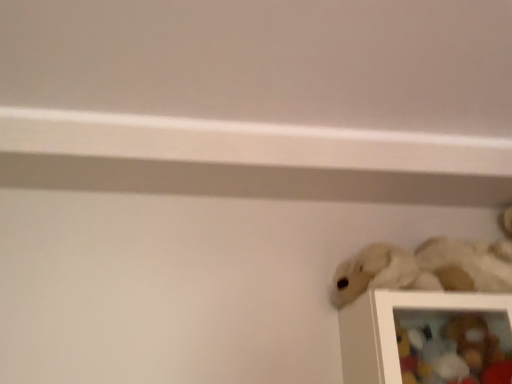
Question: Does white plush toy at lower right, placed as the 2th toy when sorted from bottom to top, have a greater width compared to fuzzy white stuffed animal at lower right, acting as the first toy starting from the top?

Choices:
 (A) yes
 (B) no

Answer: (B)

Question: Is white plush toy at lower right, which is the 2th toy in top-to-bottom order, positioned behind fuzzy white stuffed animal at lower right, the 3th toy from the bottom?

Choices:
 (A) no
 (B) yes

Answer: (B)

Question: Does white plush toy at lower right, which is the 2th toy in top-to-bottom order, appear on the left side of fuzzy white stuffed animal at lower right, the 3th toy from the bottom?

Choices:
 (A) no
 (B) yes

Answer: (B)

Question: Is the depth of white plush toy at lower right, placed as the 2th toy when sorted from bottom to top, less than that of fuzzy white stuffed animal at lower right, the 3th toy from the bottom?

Choices:
 (A) yes
 (B) no

Answer: (B)

Question: Can you see white plush toy at lower right, placed as the 2th toy when sorted from bottom to top, touching fuzzy white stuffed animal at lower right, acting as the first toy starting from the top?

Choices:
 (A) no
 (B) yes

Answer: (A)

Question: From the image's perspective, would you say white plush toy at lower right, placed as the 2th toy when sorted from bottom to top, is positioned over fuzzy white stuffed animal at lower right, acting as the first toy starting from the top?

Choices:
 (A) yes
 (B) no

Answer: (B)

Question: Is soft plush toy at lower right, which appears as the third toy when viewed from the top, facing towards white plush toy at lower right, which is the 2th toy in top-to-bottom order?

Choices:
 (A) yes
 (B) no

Answer: (B)

Question: Can you confirm if soft plush toy at lower right, which appears as the third toy when viewed from the top, is smaller than white plush toy at lower right, placed as the 2th toy when sorted from bottom to top?

Choices:
 (A) no
 (B) yes

Answer: (A)

Question: Can white plush toy at lower right, placed as the 2th toy when sorted from bottom to top, be found inside soft plush toy at lower right, which appears as the third toy when viewed from the top?

Choices:
 (A) no
 (B) yes

Answer: (B)

Question: From a real-world perspective, is soft plush toy at lower right, the first toy when ordered from bottom to top, on white plush toy at lower right, placed as the 2th toy when sorted from bottom to top?

Choices:
 (A) yes
 (B) no

Answer: (B)

Question: From the image's perspective, is soft plush toy at lower right, which appears as the third toy when viewed from the top, located beneath white plush toy at lower right, which is the 2th toy in top-to-bottom order?

Choices:
 (A) no
 (B) yes

Answer: (B)

Question: Is soft plush toy at lower right, which appears as the third toy when viewed from the top, not inside white plush toy at lower right, placed as the 2th toy when sorted from bottom to top?

Choices:
 (A) yes
 (B) no

Answer: (A)

Question: Is fuzzy white stuffed animal at lower right, the 3th toy from the bottom, next to soft plush toy at lower right, which appears as the third toy when viewed from the top, and touching it?

Choices:
 (A) yes
 (B) no

Answer: (B)